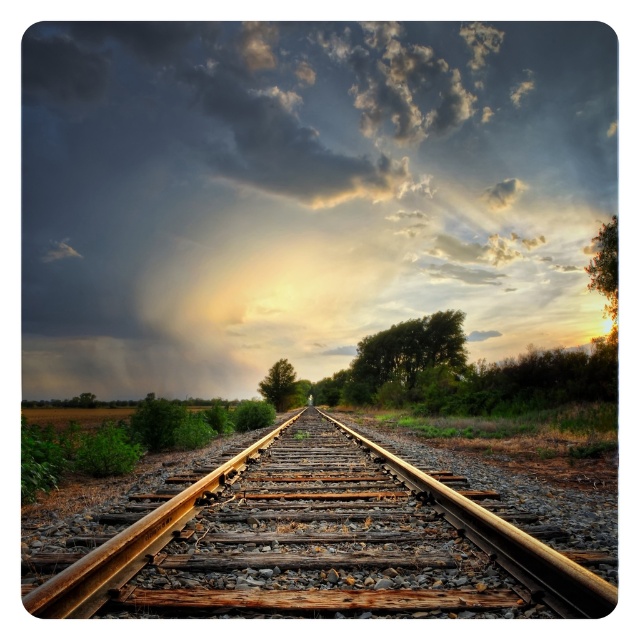
Who is more forward, (x=609, y=314) or (x=284, y=371)?

Point (x=609, y=314) is in front.

Does point (605, 268) come behind point (289, 396)?

No, (605, 268) is in front of (289, 396).

Where is `green leafy tree at upper right`? This screenshot has height=640, width=640. green leafy tree at upper right is located at coordinates (604, 266).

Who is more distant from viewer, (560, 189) or (374, 348)?

The point (560, 189) is more distant.

Is dark gray cloud at upper center bigger than green leafy tree at right?

Yes, dark gray cloud at upper center is bigger than green leafy tree at right.

Locate an element on the screen. The width and height of the screenshot is (640, 640). dark gray cloud at upper center is located at coordinates (304, 193).

Between point (195, 157) and point (595, 257), which one is positioned behind?

The point (195, 157) is more distant.

Does dark gray cloud at upper center have a lesser height compared to green leafy tree at upper right?

No.

Is point (246, 276) more distant than point (616, 266)?

Yes, it is.

At what (x,y) coordinates should I click in order to perform the action: click on dark gray cloud at upper center. Please return your answer as a coordinate pair (x, y). Looking at the image, I should click on (304, 193).